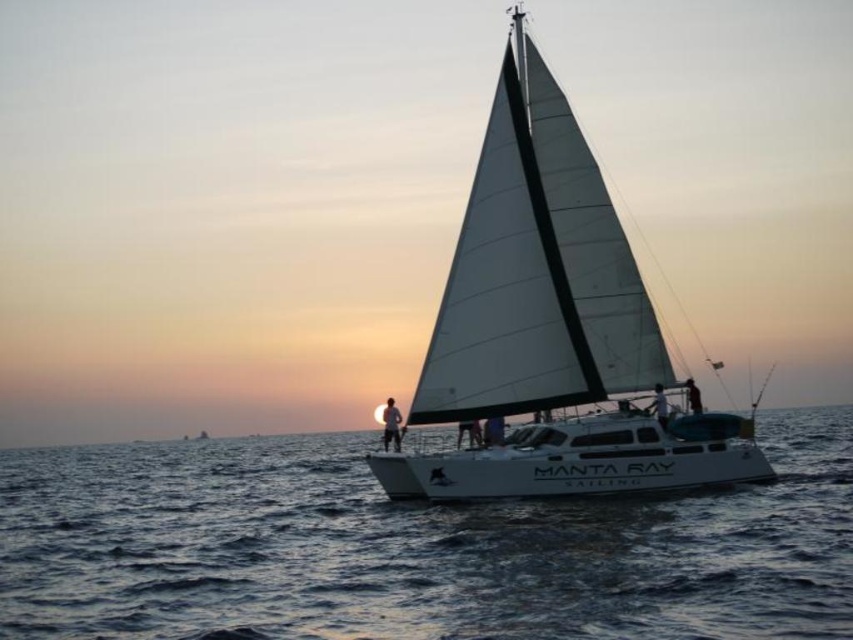
Question: Based on their relative distances, which object is nearer to the dark blue water at center?

Choices:
 (A) white matte sailboat at center
 (B) black fabric person at center
 (C) white fabric sail at center
 (D) matte white person at center

Answer: (A)

Question: Can you confirm if white matte sailboat at center is positioned above white fabric sail at center?

Choices:
 (A) no
 (B) yes

Answer: (B)

Question: Is matte white person at center wider than white fabric sail at center?

Choices:
 (A) no
 (B) yes

Answer: (B)

Question: Does white fabric sail at center appear on the right side of black fabric person at center?

Choices:
 (A) no
 (B) yes

Answer: (A)

Question: Considering the real-world distances, which object is farthest from the dark blue water at center?

Choices:
 (A) white matte sailboat at center
 (B) matte white person at center
 (C) white fabric sail at center

Answer: (B)

Question: Which is farther from the black fabric person at center?

Choices:
 (A) matte white person at center
 (B) white matte sailboat at center

Answer: (A)